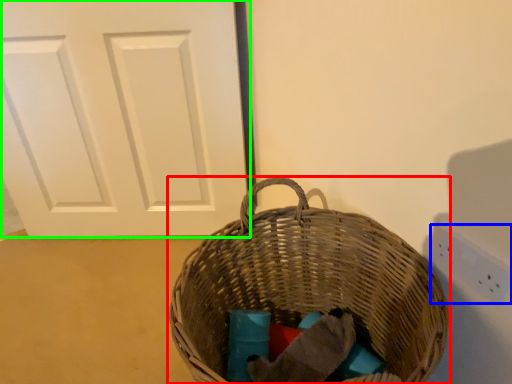
Question: Which is farther away from picnic basket (highlighted by a red box)? electric outlet (highlighted by a blue box) or door (highlighted by a green box)?

Choices:
 (A) electric outlet
 (B) door

Answer: (B)